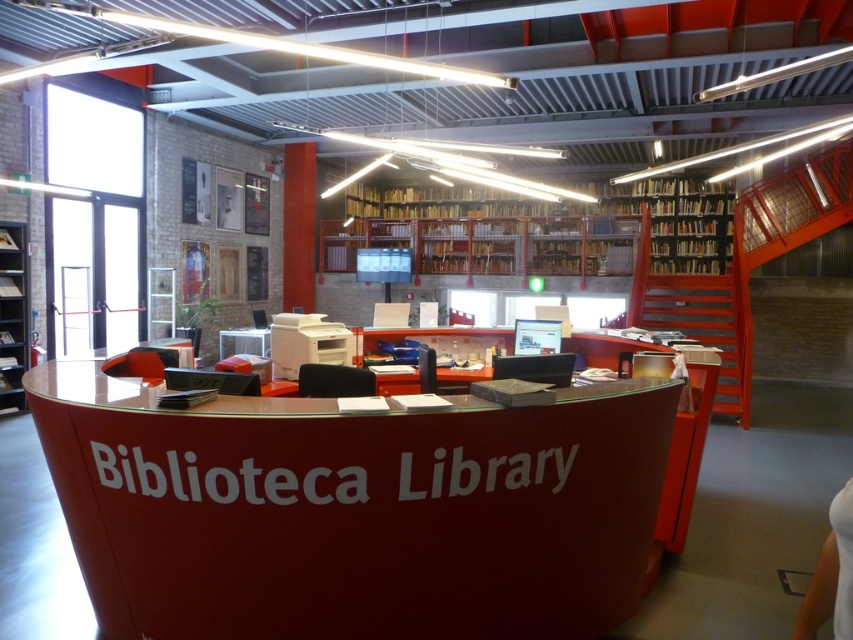
Question: Considering the relative positions of glossy red table at center and wooden shelves at upper center in the image provided, where is glossy red table at center located with respect to wooden shelves at upper center?

Choices:
 (A) left
 (B) right

Answer: (A)

Question: Is wooden shelves at upper center closer to camera compared to metallic gray bookshelf at left?

Choices:
 (A) yes
 (B) no

Answer: (B)

Question: Which is farther from the glossy red table at center?

Choices:
 (A) wooden shelves at upper center
 (B) metallic gray bookshelf at left

Answer: (A)

Question: Estimate the real-world distances between objects in this image. Which object is farther from the glossy red table at center?

Choices:
 (A) metallic gray bookshelf at left
 (B) wooden shelves at upper center

Answer: (B)

Question: Is wooden shelves at upper center wider than metallic gray bookshelf at left?

Choices:
 (A) yes
 (B) no

Answer: (A)

Question: Among these objects, which one is farthest from the camera?

Choices:
 (A) metallic gray bookshelf at left
 (B) wooden shelves at upper center

Answer: (B)